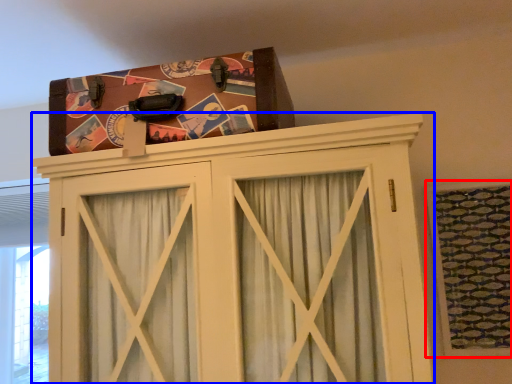
Question: Among these objects, which one is nearest to the camera, window (highlighted by a red box) or cupboard (highlighted by a blue box)?

Choices:
 (A) window
 (B) cupboard

Answer: (B)